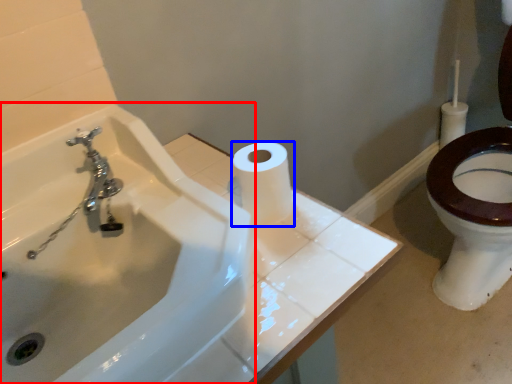
Question: Which object is closer to the camera taking this photo, sink (highlighted by a red box) or toilet paper (highlighted by a blue box)?

Choices:
 (A) sink
 (B) toilet paper

Answer: (A)